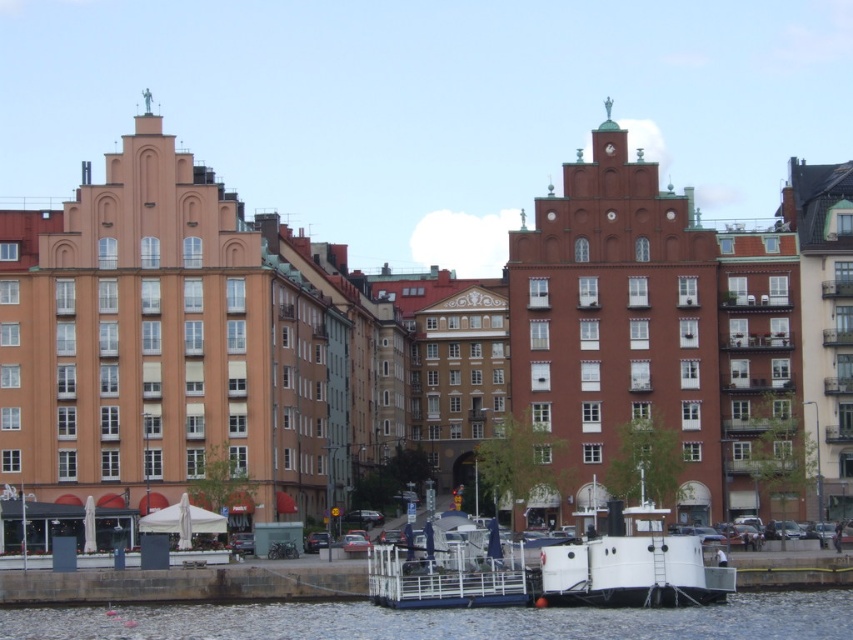
Question: Is white glossy water at lower center below white matte boat at lower center?

Choices:
 (A) yes
 (B) no

Answer: (A)

Question: Which point appears closest to the camera in this image?

Choices:
 (A) tap(474, 547)
 (B) tap(657, 616)

Answer: (B)

Question: Which point is closer to the camera?

Choices:
 (A) white glossy water at lower center
 (B) white matte boat at lower center

Answer: (A)

Question: Does white glossy water at lower center appear over white matte boat at lower center?

Choices:
 (A) no
 (B) yes

Answer: (A)

Question: Can you confirm if white glossy water at lower center is wider than white matte boat at lower center?

Choices:
 (A) no
 (B) yes

Answer: (B)